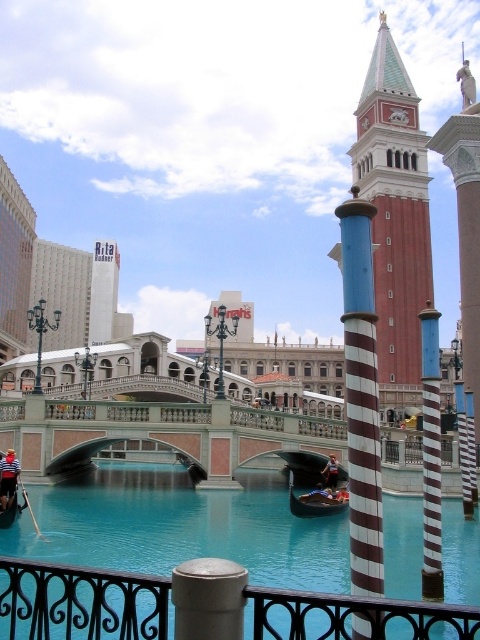
Which is more to the right, black metal railing at lower center or striped shirt oarsman at lower left?

From the viewer's perspective, black metal railing at lower center appears more on the right side.

Which is behind, point (168, 605) or point (11, 451)?

The point (11, 451) is more distant.

Locate an element on the screen. Image resolution: width=480 pixels, height=640 pixels. black metal railing at lower center is located at coordinates (81, 602).

Is point (36, 618) in front of point (316, 504)?

Yes, point (36, 618) is closer to viewer.

Who is more forward, (421, 602) or (340, 499)?

Positioned in front is point (421, 602).

At what (x,y) coordinates should I click in order to perform the action: click on teal glossy waterway at center. Please return your answer as a coordinate pair (x, y). The width and height of the screenshot is (480, 640). Looking at the image, I should click on (81, 602).

Who is higher up, blue and white striped pole at center or reddish-brown leather jacket at lower center?

blue and white striped pole at center

Between blue and white striped pole at center and reddish-brown leather jacket at lower center, which one has more height?

Standing taller between the two is blue and white striped pole at center.

Find the location of a particular element. This screenshot has width=480, height=640. blue and white striped pole at center is located at coordinates (361, 397).

Locate an element on the screen. This screenshot has height=640, width=480. blue and white striped pole at center is located at coordinates (361, 397).